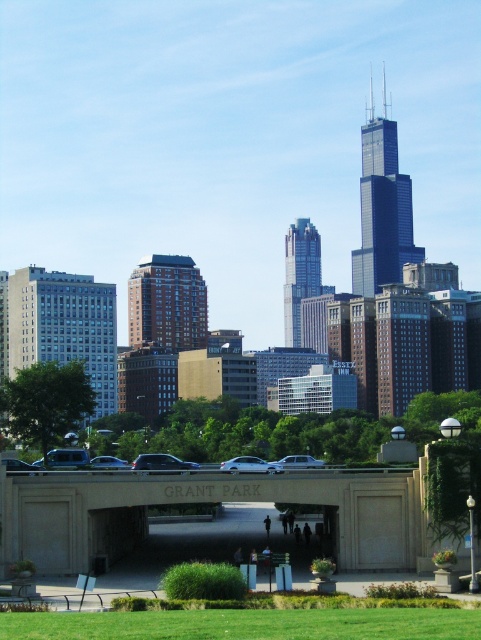
Does white matte car at center have a larger size compared to silver metallic sedan at center?

No.

Who is taller, white matte car at center or silver metallic sedan at center?

With more height is silver metallic sedan at center.

The height and width of the screenshot is (640, 481). What are the coordinates of `white matte car at center` in the screenshot? It's located at (250, 465).

Is point (311, 458) closer to viewer compared to point (106, 465)?

No, (311, 458) is further to viewer.

Is silver metallic sedan at center closer to the viewer compared to matte black car at center?

Yes, silver metallic sedan at center is closer to the viewer.

Between point (279, 467) and point (124, 460), which one is positioned in front?

Point (279, 467)

Locate an element on the screen. The height and width of the screenshot is (640, 481). silver metallic sedan at center is located at coordinates (298, 461).

Is beige concrete overpass at center thinner than white matte car at center?

In fact, beige concrete overpass at center might be wider than white matte car at center.

Who is more forward, (x=50, y=500) or (x=276, y=467)?

Positioned in front is point (x=50, y=500).

The width and height of the screenshot is (481, 640). I want to click on beige concrete overpass at center, so click(200, 500).